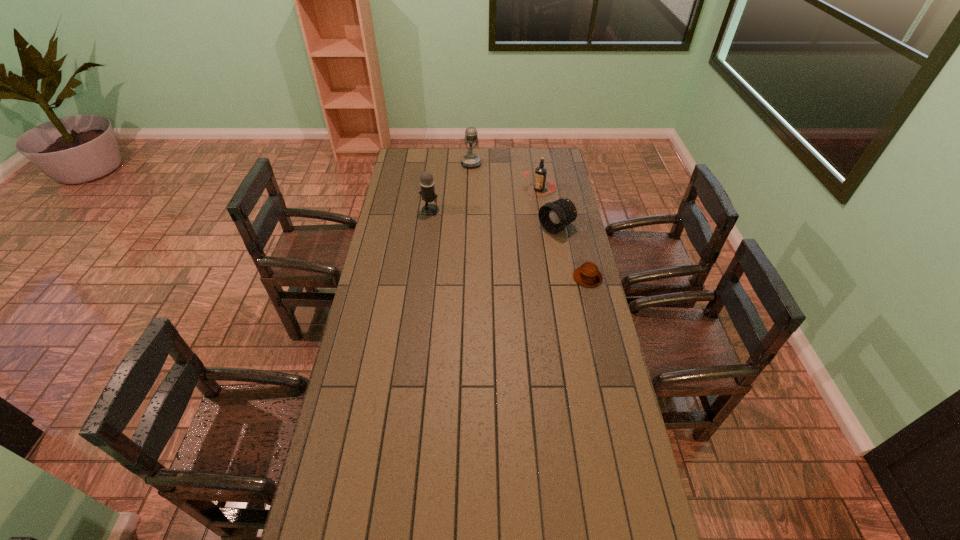
Find the location of `vacant area located on the front-facing side of the farthest object`. vacant area located on the front-facing side of the farthest object is located at coordinates (482, 211).

Image resolution: width=960 pixels, height=540 pixels. What are the coordinates of `object that is positioned at the far edge` in the screenshot? It's located at (470, 160).

The height and width of the screenshot is (540, 960). I want to click on muffin that is positioned at the right edge, so click(x=588, y=275).

This screenshot has width=960, height=540. What are the coordinates of `telephoto lens located at the right edge` in the screenshot? It's located at 554,216.

Identify the location of root beer at the right edge. Image resolution: width=960 pixels, height=540 pixels. (540, 173).

This screenshot has height=540, width=960. I want to click on vacant space at the far edge of the desktop, so click(445, 161).

This screenshot has width=960, height=540. In order to click on free space at the left edge of the desktop in this screenshot , I will do `click(372, 337)`.

Locate an element on the screen. The height and width of the screenshot is (540, 960). free space at the right edge is located at coordinates (566, 347).

In the image, there is a desktop. Where is `vacant space at the far right corner`? The width and height of the screenshot is (960, 540). vacant space at the far right corner is located at coordinates [553, 157].

Locate an element on the screen. This screenshot has width=960, height=540. free space between the nearer microphone and the right microphone is located at coordinates (450, 187).